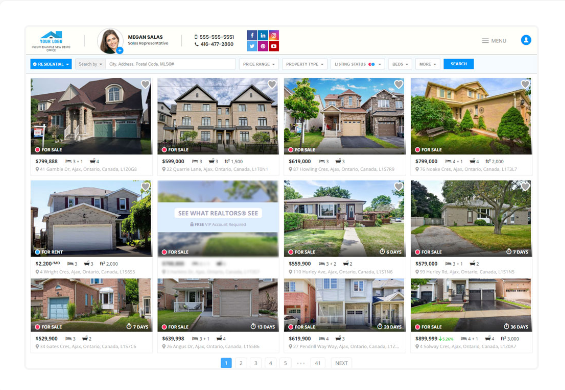
Image resolution: width=565 pixels, height=390 pixels. I want to click on windows, so [x=328, y=211], [x=471, y=91], [x=357, y=285], [x=333, y=284], [x=105, y=299].